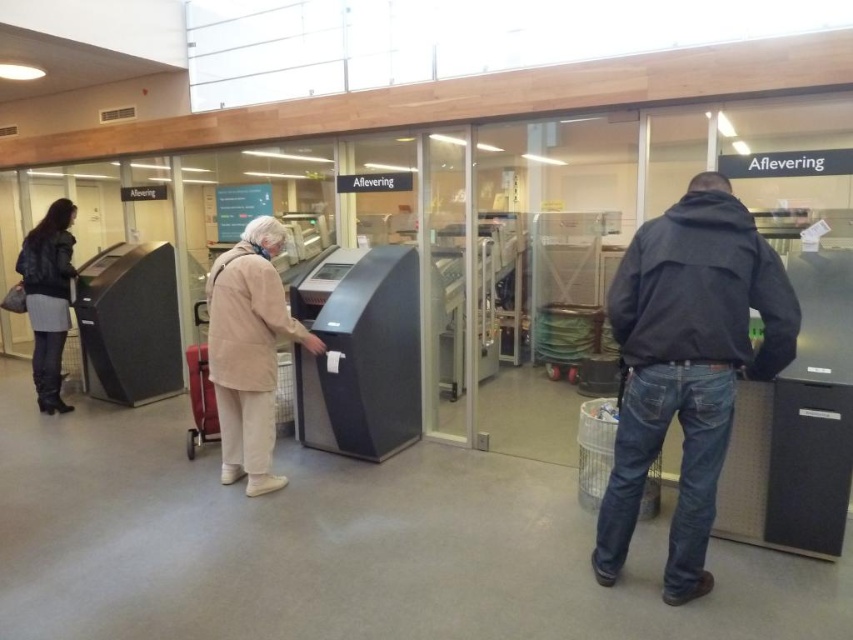
You are navigating through the facility and need to reach a specific point. From your current position, you see two points marked in the scene. Which of the two points, point [241,472] or point [51,234], is closer to you?

Point [241,472] is closer to you because it is in front of point [51,234].